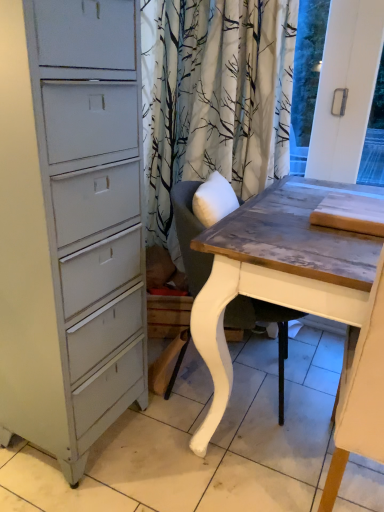
This screenshot has height=512, width=384. Identify the location of free area in between white painted wood chair at center and wooden table at right. (240, 448).